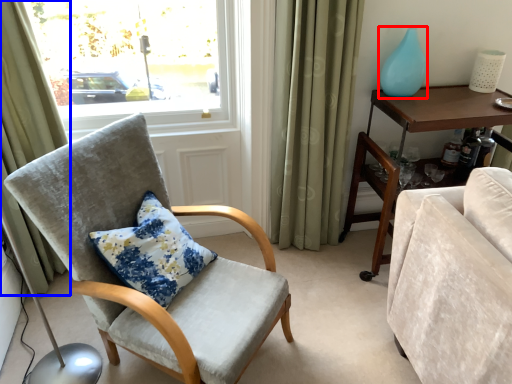
Question: Which of the following is the farthest to the observer, glass vase (highlighted by a red box) or curtain (highlighted by a blue box)?

Choices:
 (A) glass vase
 (B) curtain

Answer: (A)